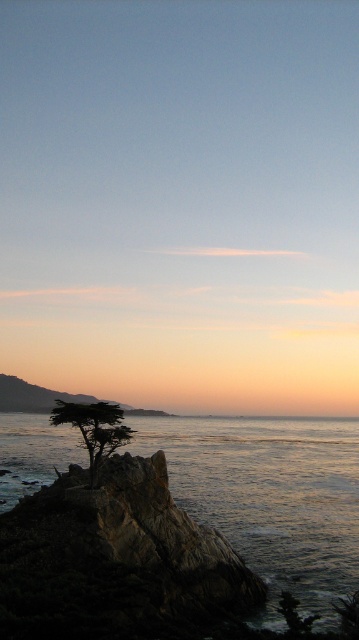
From the picture: Does shiny silver water at center have a greater width compared to green matte tree at center?

Indeed, shiny silver water at center has a greater width compared to green matte tree at center.

Looking at this image, who is lower down, shiny silver water at center or green matte tree at center?

shiny silver water at center

Between point (226, 432) and point (91, 440), which one is positioned in front?

Point (91, 440)

Identify the location of shiny silver water at center. (269, 493).